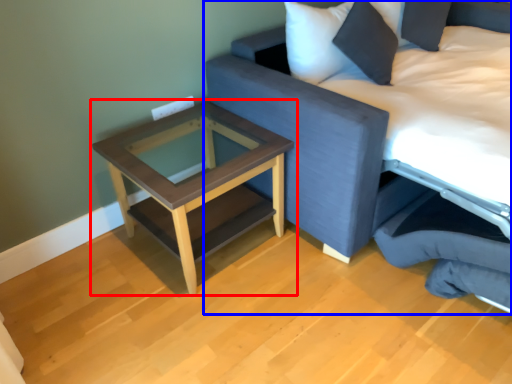
Question: Which object appears farthest to the camera in this image, table (highlighted by a red box) or studio couch (highlighted by a blue box)?

Choices:
 (A) table
 (B) studio couch

Answer: (A)